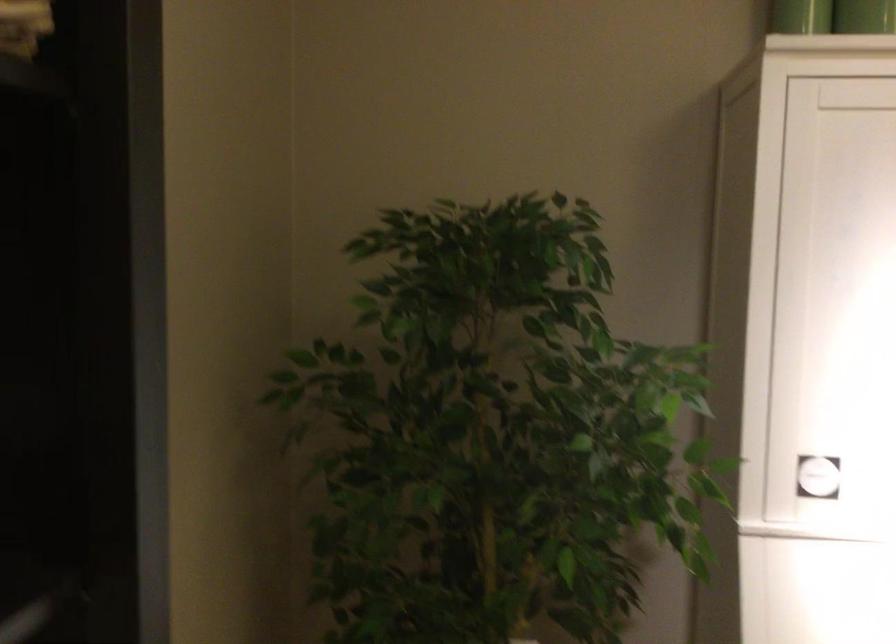
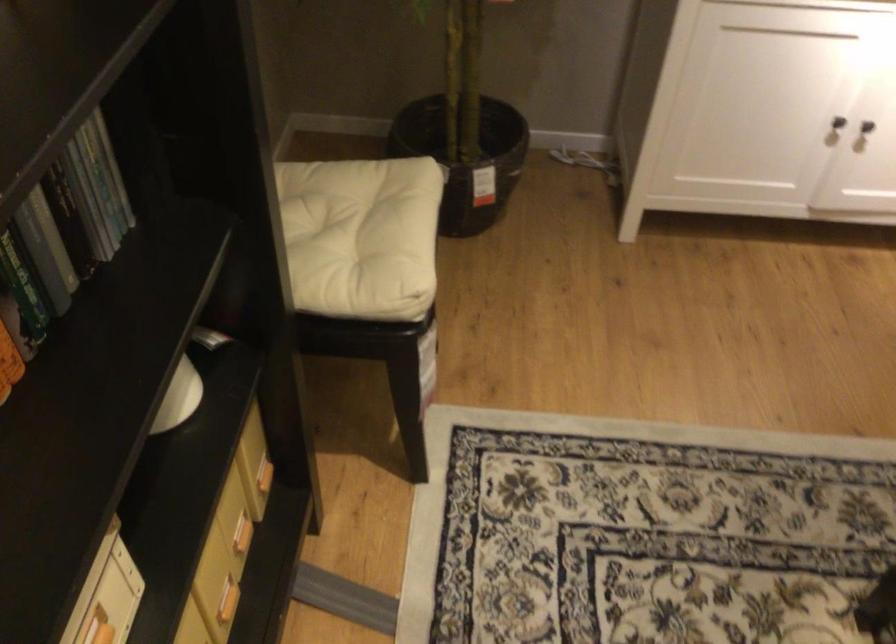
Question: The images are taken continuously from a first-person perspective. In which direction is your viewpoint rotating?

Choices:
 (A) Left
 (B) Right
 (C) Up
 (D) Down

Answer: (D)